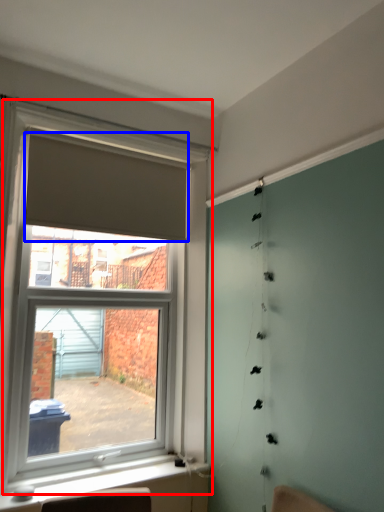
Question: Which point is closer to the camera, window (highlighted by a red box) or curtain (highlighted by a blue box)?

Choices:
 (A) window
 (B) curtain

Answer: (A)